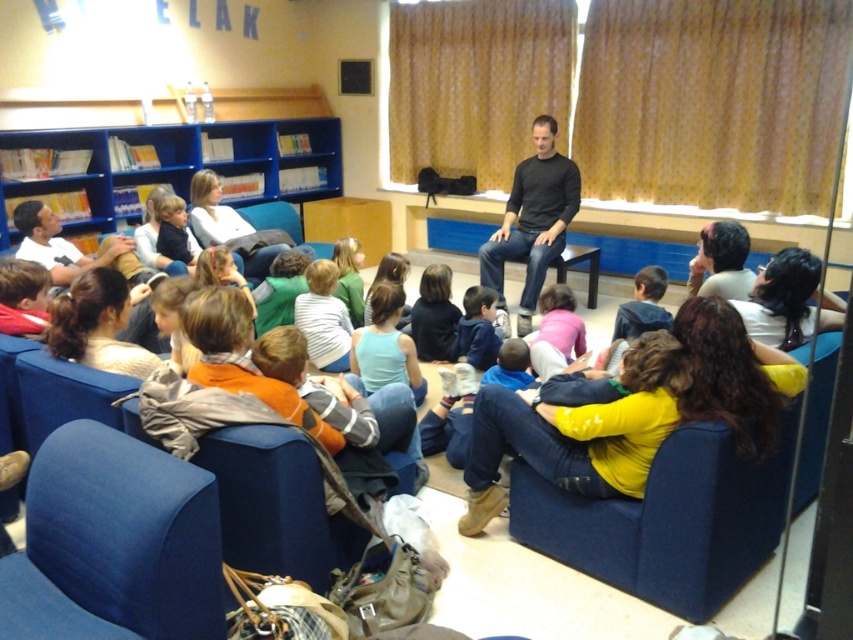
Question: Among these objects, which one is nearest to the camera?

Choices:
 (A) smooth brown hair at center
 (B) dark brown hair at upper right
 (C) blue fabric armchair at lower left

Answer: (C)

Question: Is blue plastic bookshelf at upper left further to the viewer compared to black matte shirt at center?

Choices:
 (A) yes
 (B) no

Answer: (A)

Question: Which point is farther from the camera taking this photo?

Choices:
 (A) (482, 248)
 (B) (158, 627)
 (C) (339, 348)
 (D) (808, 476)

Answer: (A)

Question: Which of these objects is positioned farthest from the smooth brown hair at center?

Choices:
 (A) matte blue armchair at lower right
 (B) light blue fabric shirt at center
 (C) light brown hair at center

Answer: (A)

Question: Can you confirm if blue fabric armchair at lower left is wider than striped cotton shirt at center?

Choices:
 (A) no
 (B) yes

Answer: (B)

Question: Is striped cotton shirt at center positioned at the back of dark blue shirt at center?

Choices:
 (A) no
 (B) yes

Answer: (A)